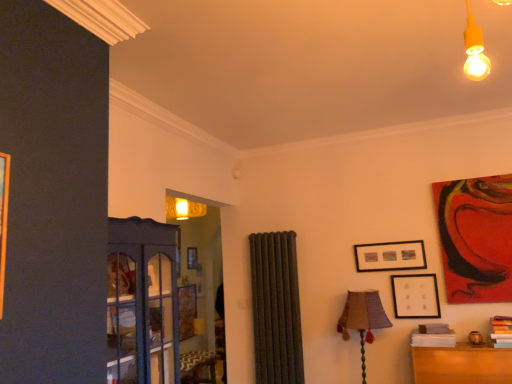
Question: Is black matte picture frame at upper right, which is counted as the third picture frame, starting from the right, positioned in front of red glossy painting at upper right, arranged as the third picture frame when viewed from the left?

Choices:
 (A) no
 (B) yes

Answer: (A)

Question: From a real-world perspective, is black matte picture frame at upper right, marked as the first picture frame in a left-to-right arrangement, positioned under red glossy painting at upper right, arranged as the third picture frame when viewed from the left, based on gravity?

Choices:
 (A) no
 (B) yes

Answer: (B)

Question: From a real-world perspective, is black matte picture frame at upper right, marked as the first picture frame in a left-to-right arrangement, on top of red glossy painting at upper right, the first picture frame from the right?

Choices:
 (A) no
 (B) yes

Answer: (A)

Question: From the image's perspective, does black matte picture frame at upper right, which is counted as the third picture frame, starting from the right, appear lower than red glossy painting at upper right, arranged as the third picture frame when viewed from the left?

Choices:
 (A) no
 (B) yes

Answer: (B)

Question: Can you confirm if black matte picture frame at upper right, marked as the first picture frame in a left-to-right arrangement, is shorter than red glossy painting at upper right, arranged as the third picture frame when viewed from the left?

Choices:
 (A) no
 (B) yes

Answer: (B)

Question: Does black matte picture frame at upper right, marked as the first picture frame in a left-to-right arrangement, have a greater height compared to red glossy painting at upper right, the first picture frame from the right?

Choices:
 (A) yes
 (B) no

Answer: (B)

Question: Is matte black picture frame at lower right, the second picture frame viewed from the left, smaller than red glossy painting at upper right, arranged as the third picture frame when viewed from the left?

Choices:
 (A) yes
 (B) no

Answer: (A)

Question: Could red glossy painting at upper right, arranged as the third picture frame when viewed from the left, be considered to be inside matte black picture frame at lower right, marked as the second picture frame in a right-to-left arrangement?

Choices:
 (A) yes
 (B) no

Answer: (B)

Question: From a real-world perspective, is matte black picture frame at lower right, marked as the second picture frame in a right-to-left arrangement, on top of red glossy painting at upper right, arranged as the third picture frame when viewed from the left?

Choices:
 (A) yes
 (B) no

Answer: (B)

Question: Is matte black picture frame at lower right, marked as the second picture frame in a right-to-left arrangement, oriented towards red glossy painting at upper right, the first picture frame from the right?

Choices:
 (A) yes
 (B) no

Answer: (B)

Question: Can you see matte black picture frame at lower right, the second picture frame viewed from the left, touching red glossy painting at upper right, arranged as the third picture frame when viewed from the left?

Choices:
 (A) yes
 (B) no

Answer: (B)

Question: Is matte black picture frame at lower right, the second picture frame viewed from the left, further to the viewer compared to red glossy painting at upper right, the first picture frame from the right?

Choices:
 (A) yes
 (B) no

Answer: (A)

Question: Is black matte picture frame at upper right, marked as the first picture frame in a left-to-right arrangement, oriented away from matte black picture frame at lower right, the second picture frame viewed from the left?

Choices:
 (A) no
 (B) yes

Answer: (A)